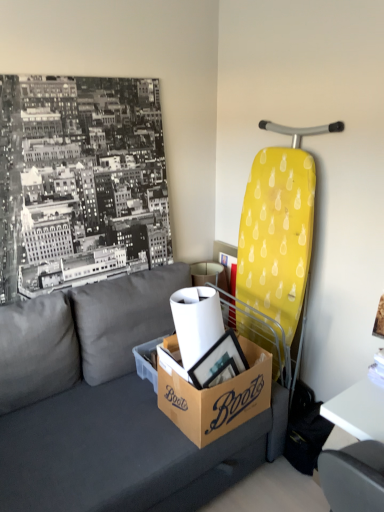
Question: From a real-world perspective, is brown cardboard box at lower center on dark gray fabric couch at center?

Choices:
 (A) yes
 (B) no

Answer: (A)

Question: Is brown cardboard box at lower center positioned before dark gray fabric couch at center?

Choices:
 (A) no
 (B) yes

Answer: (A)

Question: From a real-world perspective, does brown cardboard box at lower center sit lower than dark gray fabric couch at center?

Choices:
 (A) yes
 (B) no

Answer: (B)

Question: Can you confirm if brown cardboard box at lower center is shorter than dark gray fabric couch at center?

Choices:
 (A) no
 (B) yes

Answer: (B)

Question: Would you say brown cardboard box at lower center is a long distance from dark gray fabric couch at center?

Choices:
 (A) no
 (B) yes

Answer: (A)

Question: Is brown cardboard box at lower center in contact with dark gray fabric couch at center?

Choices:
 (A) yes
 (B) no

Answer: (B)

Question: Are dark gray fabric couch at center and brown cardboard box at center located far from each other?

Choices:
 (A) no
 (B) yes

Answer: (A)

Question: Is dark gray fabric couch at center bigger than brown cardboard box at center?

Choices:
 (A) no
 (B) yes

Answer: (B)

Question: Does dark gray fabric couch at center have a lesser width compared to brown cardboard box at center?

Choices:
 (A) no
 (B) yes

Answer: (A)

Question: Does dark gray fabric couch at center have a greater height compared to brown cardboard box at center?

Choices:
 (A) no
 (B) yes

Answer: (B)

Question: Is dark gray fabric couch at center in front of brown cardboard box at center?

Choices:
 (A) no
 (B) yes

Answer: (B)

Question: Is dark gray fabric couch at center turned away from brown cardboard box at center?

Choices:
 (A) no
 (B) yes

Answer: (B)

Question: Is brown cardboard box at lower center at the back of white glossy table at lower right?

Choices:
 (A) no
 (B) yes

Answer: (A)